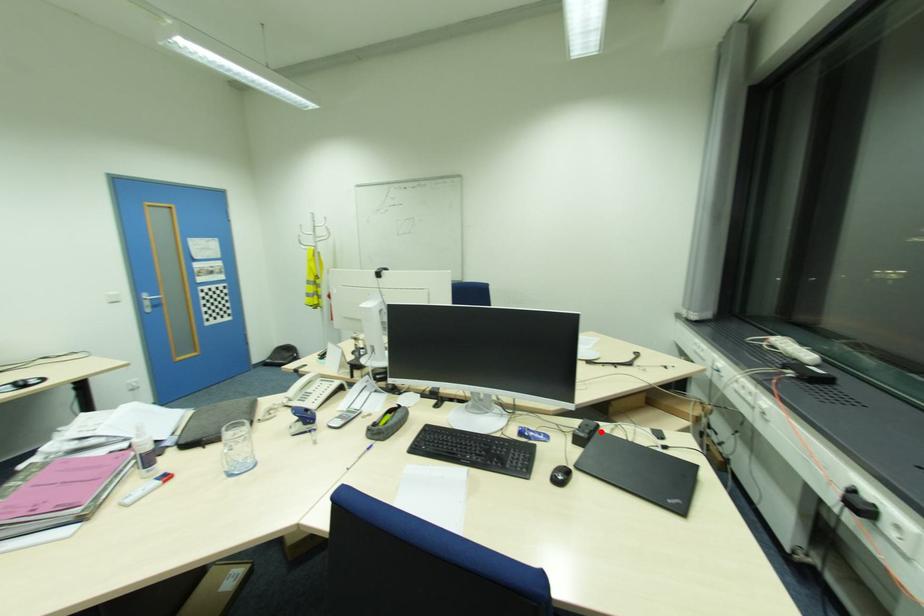
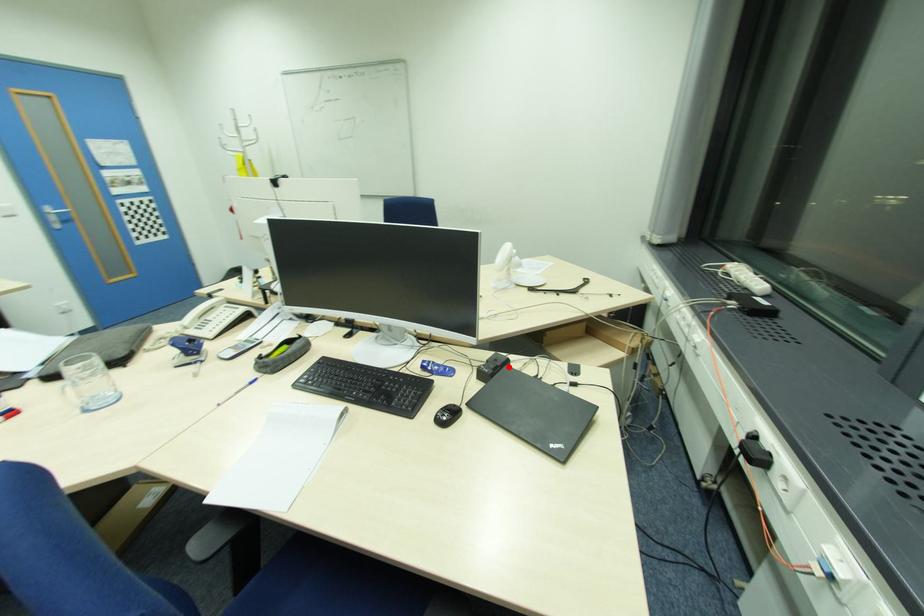
I am providing you with two images of the same scene from different viewpoints. A red point is marked on the first image and another point is marked on the second image. Does the point marked in image1 correspond to the same location as the one in image2?

Yes